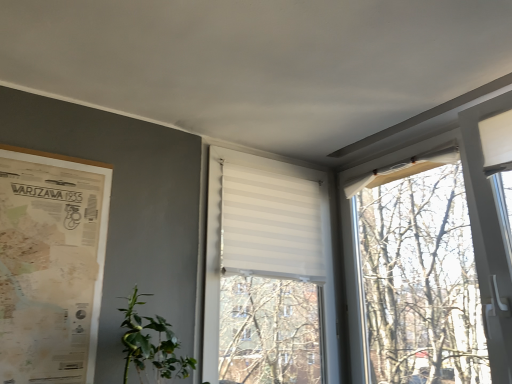
Question: Is vintage paper map at left next to green leafy plant at lower left and touching it?

Choices:
 (A) no
 (B) yes

Answer: (A)

Question: Is green leafy plant at lower left at the back of vintage paper map at left?

Choices:
 (A) yes
 (B) no

Answer: (B)

Question: Does vintage paper map at left turn towards green leafy plant at lower left?

Choices:
 (A) yes
 (B) no

Answer: (B)

Question: Considering the relative sizes of vintage paper map at left and green leafy plant at lower left in the image provided, is vintage paper map at left shorter than green leafy plant at lower left?

Choices:
 (A) no
 (B) yes

Answer: (A)

Question: From a real-world perspective, is vintage paper map at left physically below green leafy plant at lower left?

Choices:
 (A) yes
 (B) no

Answer: (B)

Question: Is green leafy plant at lower left inside the boundaries of white striped blind at center, or outside?

Choices:
 (A) outside
 (B) inside

Answer: (A)

Question: Visually, is green leafy plant at lower left positioned to the left or to the right of white striped blind at center?

Choices:
 (A) left
 (B) right

Answer: (A)

Question: From the image's perspective, is green leafy plant at lower left located above or below white striped blind at center?

Choices:
 (A) below
 (B) above

Answer: (A)

Question: Is point (151, 349) closer or farther from the camera than point (329, 304)?

Choices:
 (A) closer
 (B) farther

Answer: (A)

Question: Which is correct: white striped blind at center is inside vintage paper map at left, or outside of it?

Choices:
 (A) outside
 (B) inside

Answer: (A)

Question: From the image's perspective, is white striped blind at center located above or below vintage paper map at left?

Choices:
 (A) below
 (B) above

Answer: (A)

Question: Would you say white striped blind at center is to the left or to the right of vintage paper map at left in the picture?

Choices:
 (A) right
 (B) left

Answer: (A)

Question: Relative to vintage paper map at left, is white striped blind at center in front or behind?

Choices:
 (A) front
 (B) behind

Answer: (B)

Question: In terms of height, does vintage paper map at left look taller or shorter compared to white striped blind at center?

Choices:
 (A) short
 (B) tall

Answer: (A)

Question: Looking at their shapes, would you say vintage paper map at left is wider or thinner than white striped blind at center?

Choices:
 (A) thin
 (B) wide

Answer: (A)